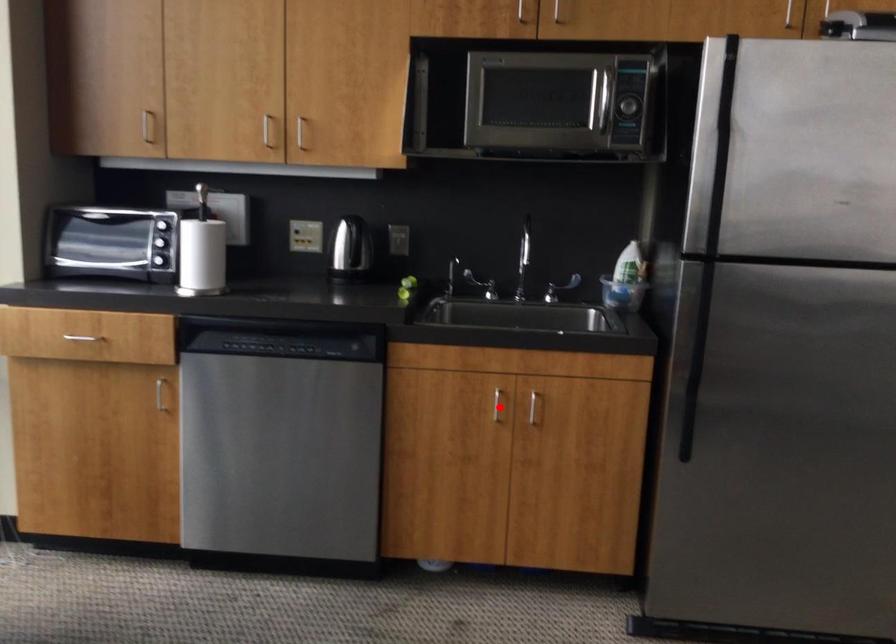
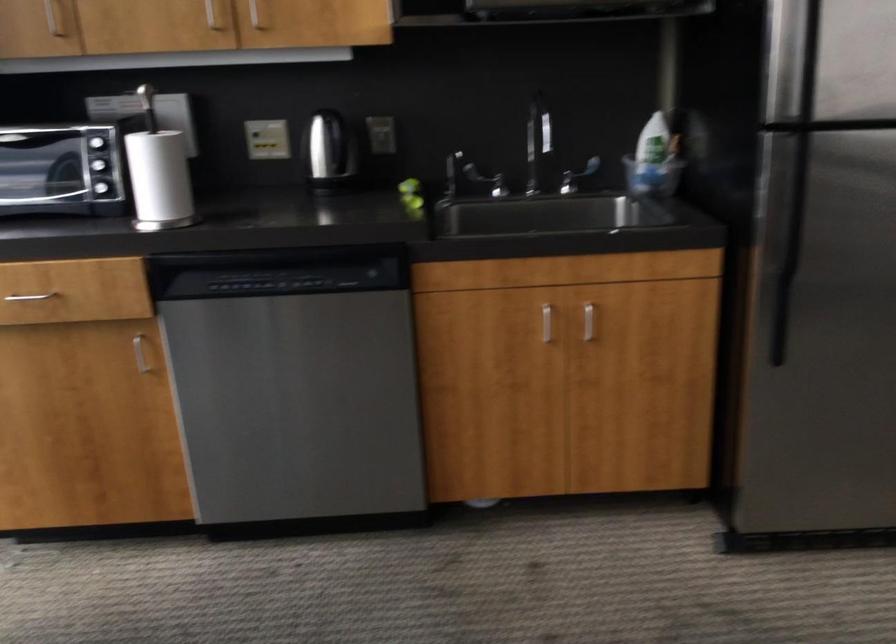
Question: I am providing you with two images of the same scene from different viewpoints. A red point is shown in image1. For the corresponding object point in image2, is it positioned nearer or farther from the camera?

Choices:
 (A) Nearer
 (B) Farther

Answer: (A)